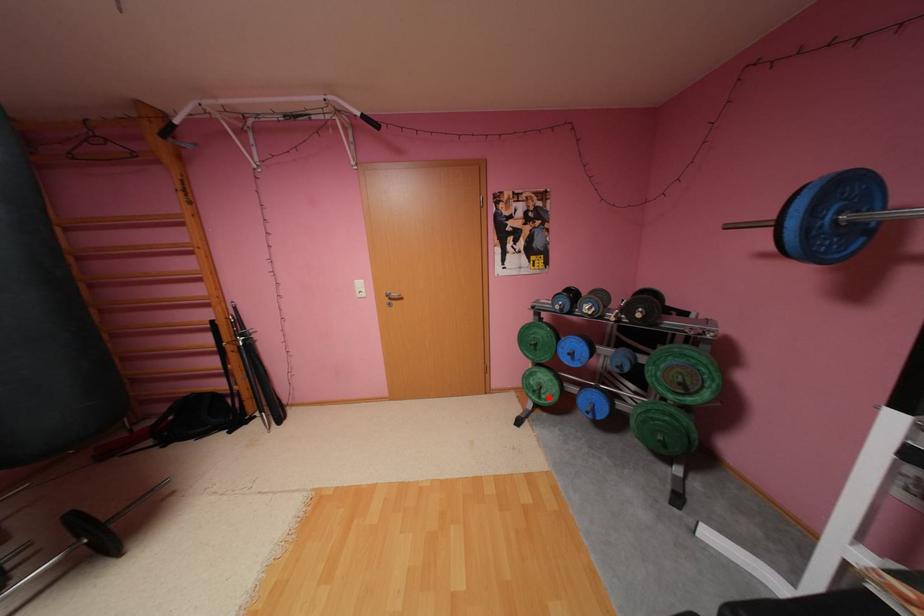
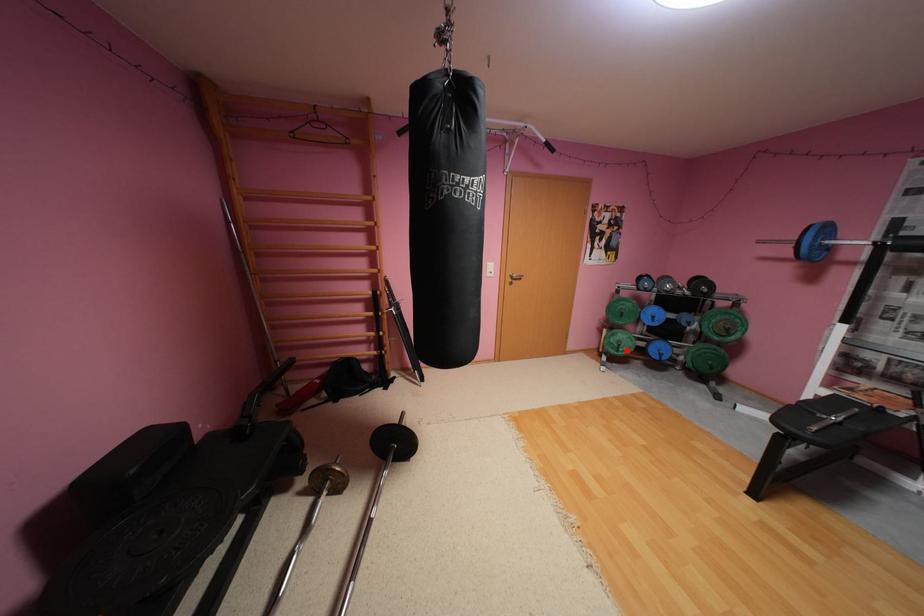
I am providing you with two images of the same scene from different viewpoints. A red point is marked on the first image and another point is marked on the second image. Is the marked point in image1 the same physical position as the marked point in image2?

Yes